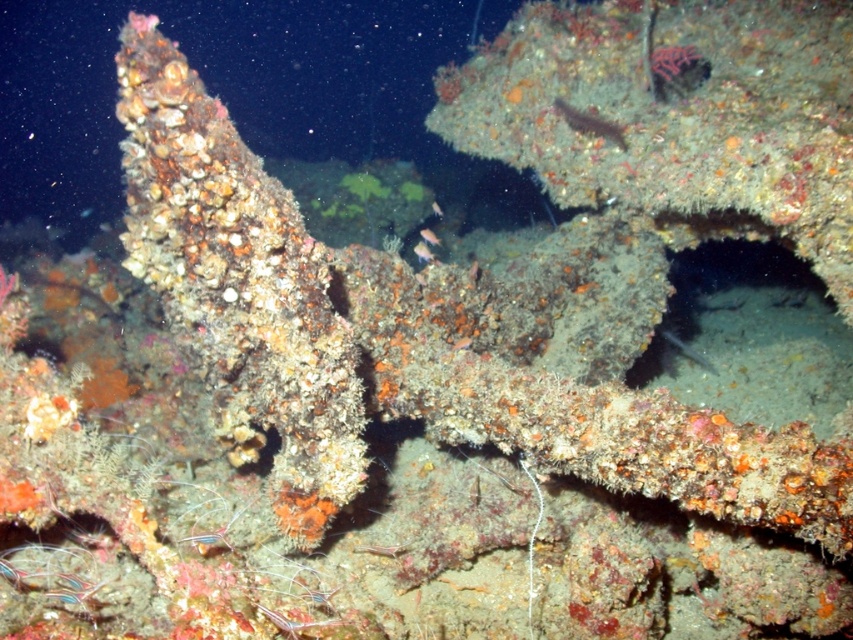
Question: Which object appears closest to the camera in this image?

Choices:
 (A) silvery metallic fish at center
 (B) smooth brown fish at center
 (C) translucent orange fish at center
 (D) shiny silver fish at center

Answer: (B)

Question: Can you confirm if translucent orange fish at center is wider than orange coral-like at center?

Choices:
 (A) no
 (B) yes

Answer: (B)

Question: Which object is farther from the camera taking this photo?

Choices:
 (A) smooth brown fish at center
 (B) silvery metallic fish at center

Answer: (B)

Question: From the image, what is the correct spatial relationship of smooth brown fish at center in relation to silvery metallic fish at center?

Choices:
 (A) left
 (B) right

Answer: (A)

Question: Which point is closer to the camera?

Choices:
 (A) (424, 250)
 (B) (430, 236)
 (C) (590, 131)

Answer: (C)

Question: Is silvery metallic fish at center thinner than orange coral-like at center?

Choices:
 (A) no
 (B) yes

Answer: (A)